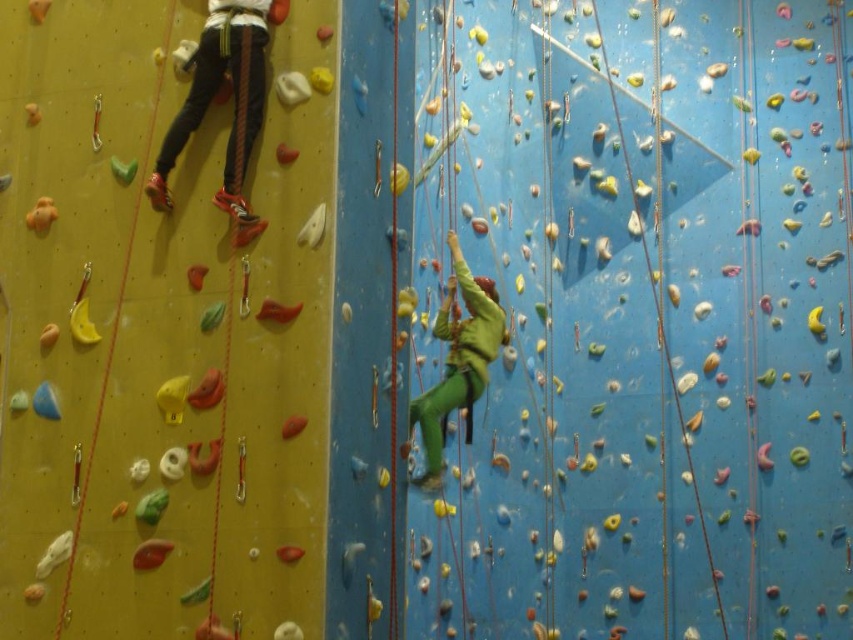
Question: Which object appears closest to the camera in this image?

Choices:
 (A) matte black pants at left
 (B) green matte climbing suit at center

Answer: (A)

Question: Which point appears closest to the camera in this image?

Choices:
 (A) (479, 365)
 (B) (250, 83)

Answer: (B)

Question: Which object appears farthest from the camera in this image?

Choices:
 (A) matte black pants at left
 (B) green matte climbing suit at center

Answer: (B)

Question: Can you confirm if matte black pants at left is positioned to the right of green matte climbing suit at center?

Choices:
 (A) yes
 (B) no

Answer: (B)

Question: Is matte black pants at left positioned at the back of green matte climbing suit at center?

Choices:
 (A) yes
 (B) no

Answer: (B)

Question: Is matte black pants at left below green matte climbing suit at center?

Choices:
 (A) no
 (B) yes

Answer: (A)